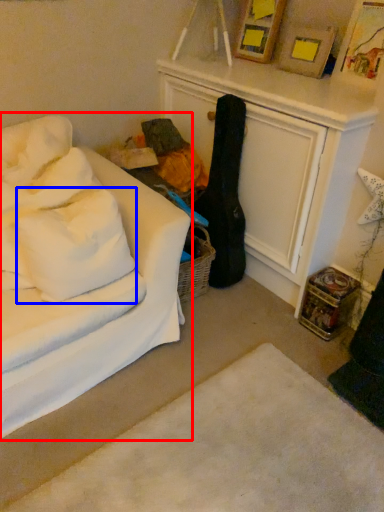
Question: Which object appears closest to the camera in this image, studio couch (highlighted by a red box) or pillow (highlighted by a blue box)?

Choices:
 (A) studio couch
 (B) pillow

Answer: (A)